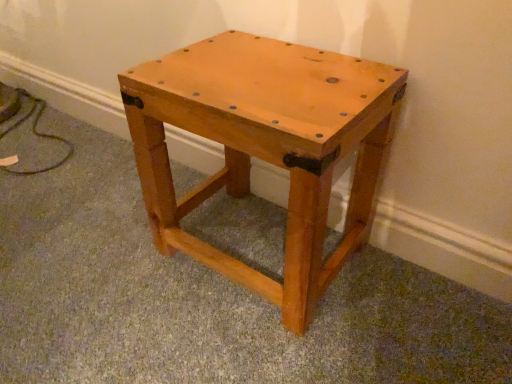
Locate an element on the screen. Image resolution: width=512 pixels, height=384 pixels. free space in front of light brown wood stool at center is located at coordinates (260, 340).